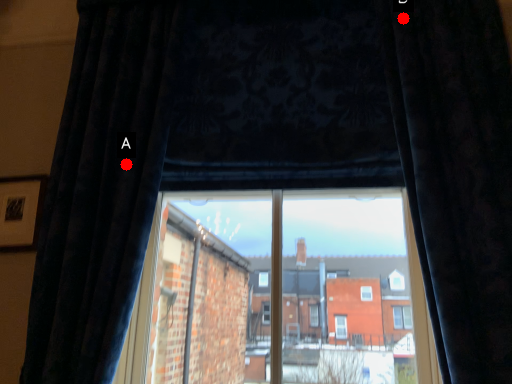
Question: Two points are circled on the image, labeled by A and B beside each circle. Which point appears closest to the camera in this image?

Choices:
 (A) A is closer
 (B) B is closer

Answer: (A)